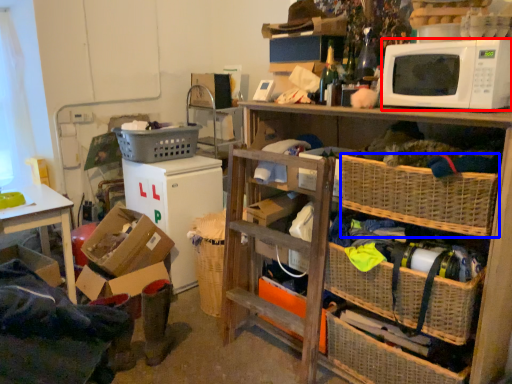
Question: Which object is closer to the camera taking this photo, microwave oven (highlighted by a red box) or picnic basket (highlighted by a blue box)?

Choices:
 (A) microwave oven
 (B) picnic basket

Answer: (A)